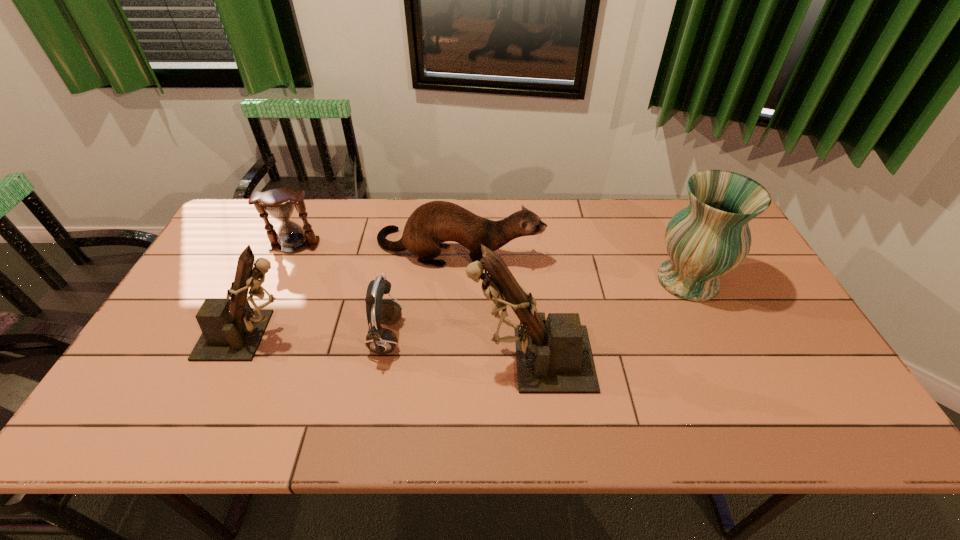
Identify the location of blank space located on the front-facing side of the right figurine. The height and width of the screenshot is (540, 960). (351, 359).

This screenshot has width=960, height=540. In order to click on vacant area situated on the left of the rightmost object in this screenshot , I will do `click(566, 280)`.

At what (x,y) coordinates should I click in order to perform the action: click on free point located 0.170m on the front of the hourglass. Please return your answer as a coordinate pair (x, y). The image size is (960, 540). Looking at the image, I should click on (273, 294).

I want to click on vacant space positioned at the face of the ferret, so click(x=601, y=249).

Locate an element on the screen. This screenshot has height=540, width=960. vacant space located on the ear pads of the earphone is located at coordinates (521, 338).

Where is `hourglass located at the far edge`? This screenshot has height=540, width=960. hourglass located at the far edge is located at coordinates (279, 203).

At what (x,y) coordinates should I click in order to perform the action: click on ferret located at the far edge. Please return your answer as a coordinate pair (x, y). Looking at the image, I should click on (431, 224).

This screenshot has height=540, width=960. What are the coordinates of `figurine situated at the near edge` in the screenshot? It's located at 554,355.

Find the location of a particular element. Image resolution: width=960 pixels, height=540 pixels. earphone that is at the near edge is located at coordinates (379, 340).

Locate an element on the screen. object located in the left edge section of the desktop is located at coordinates (231, 330).